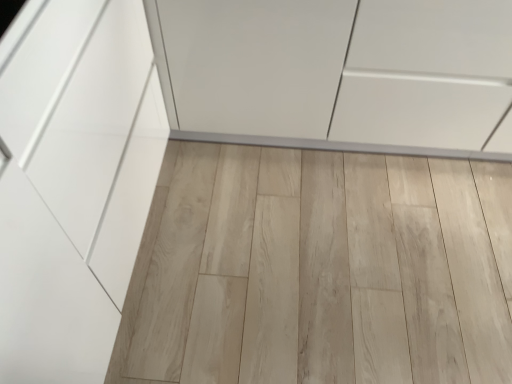
Where is `vacant space in front of white glossy cabinet at center`? The image size is (512, 384). vacant space in front of white glossy cabinet at center is located at coordinates (318, 250).